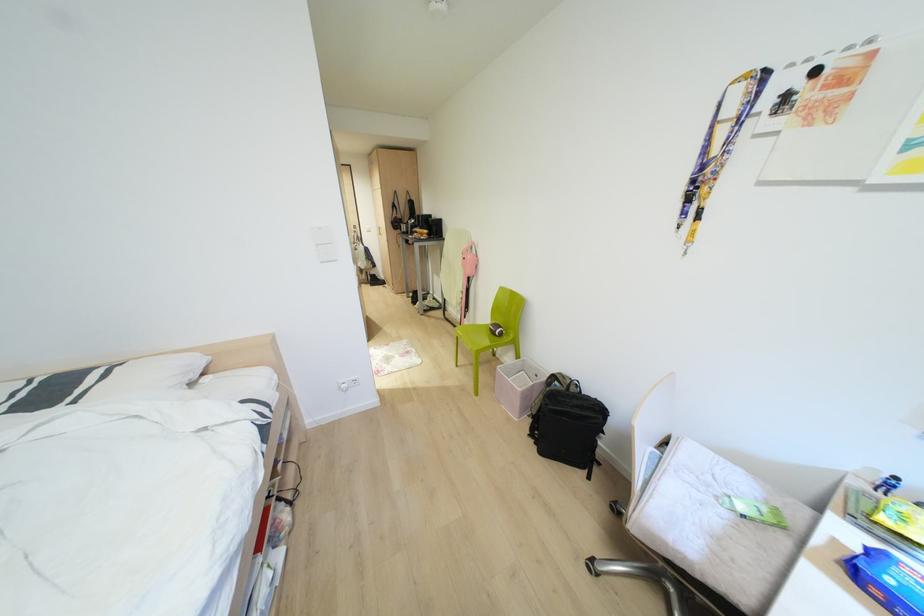
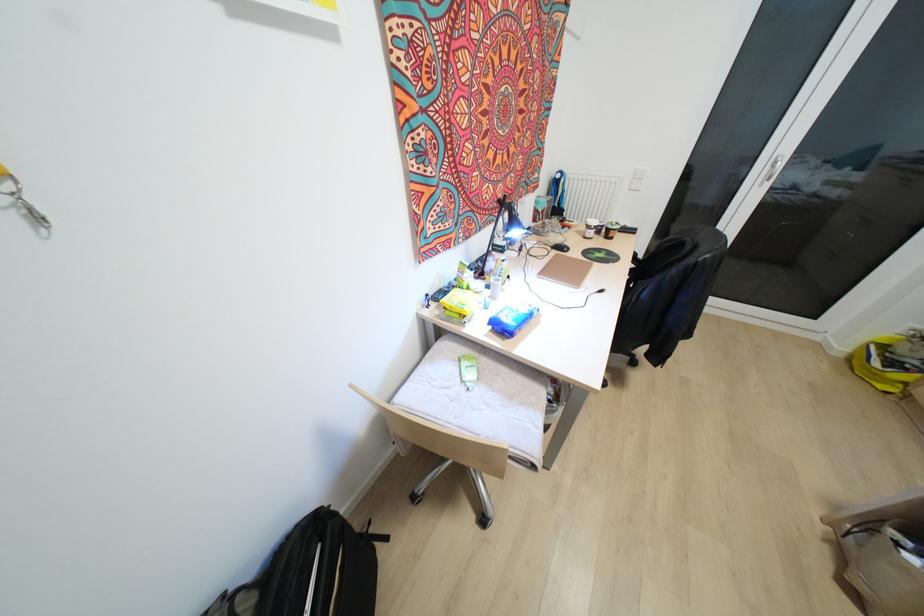
Find the pixel in the second image that matches point (702, 544) in the first image.

(519, 408)